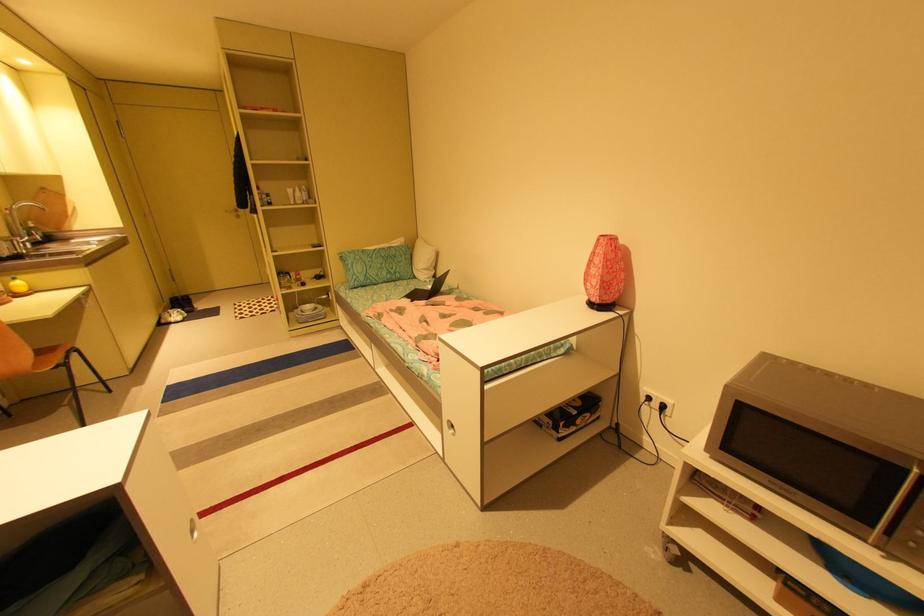
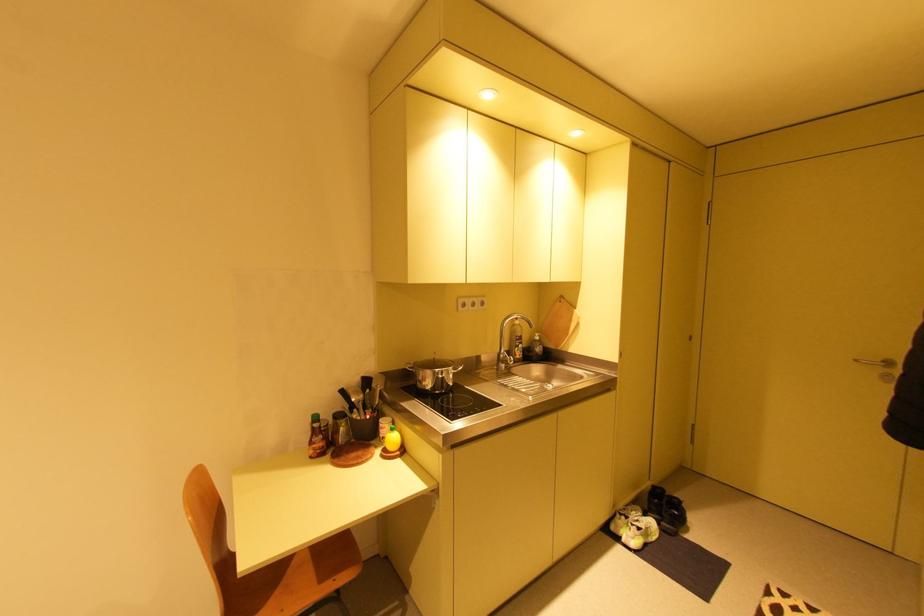
Locate, in the second image, the point that corresponds to (x=232, y=211) in the first image.

(861, 361)